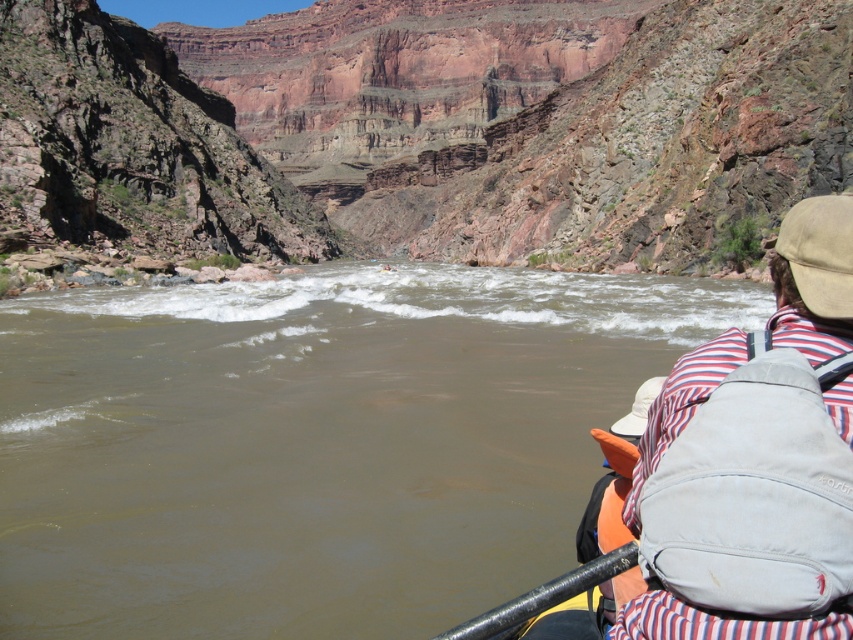
Question: Which object is closer to the camera taking this photo?

Choices:
 (A) orange fabric life jacket at lower right
 (B) brown muddy water at center
 (C) rustic rock canyon at center
 (D) striped fabric shirt at right

Answer: (D)

Question: Which object appears closest to the camera in this image?

Choices:
 (A) striped fabric shirt at right
 (B) brown muddy water at center

Answer: (A)

Question: Can you confirm if rustic rock canyon at center is smaller than orange fabric life jacket at lower right?

Choices:
 (A) no
 (B) yes

Answer: (A)

Question: Does brown muddy water at center have a greater width compared to rustic rock canyon at center?

Choices:
 (A) no
 (B) yes

Answer: (A)

Question: Considering the real-world distances, which object is closest to the rustic rock canyon at center?

Choices:
 (A) orange fabric life jacket at lower right
 (B) striped fabric shirt at right

Answer: (B)

Question: Does rustic rock canyon at center appear on the right side of orange fabric life jacket at lower right?

Choices:
 (A) yes
 (B) no

Answer: (B)